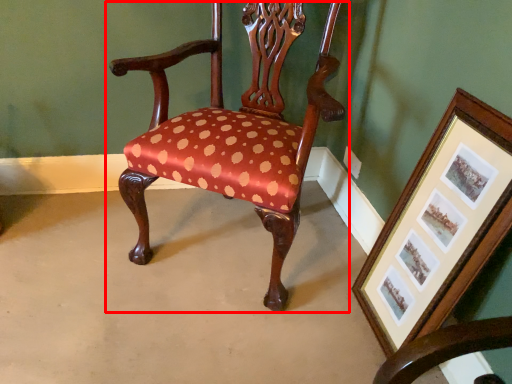
Question: In this image, where is chair (annotated by the red box) located relative to picture frame?

Choices:
 (A) left
 (B) right

Answer: (A)